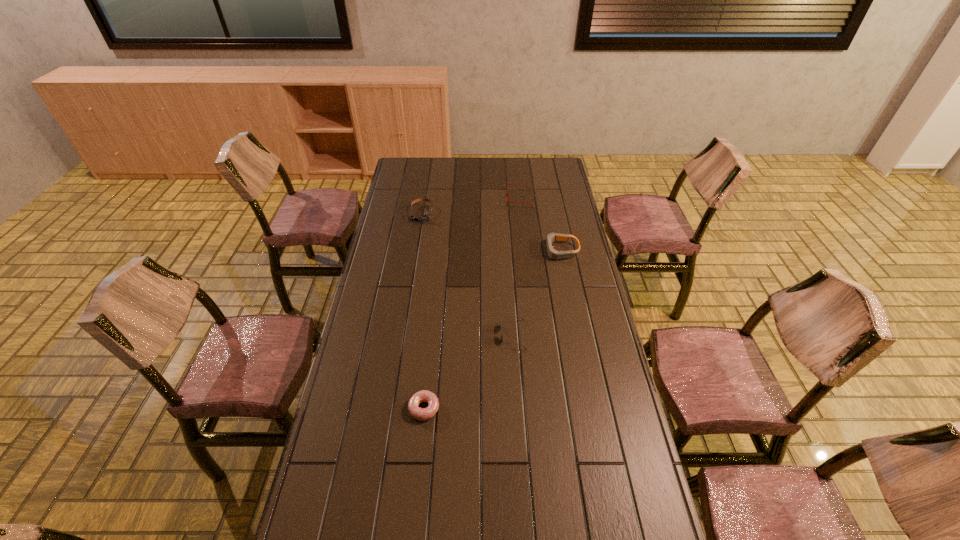
You are a GUI agent. You are given a task and a screenshot of the screen. Output one action in this format:
    pyautogui.click(x=<x>, y=<y>)
    Task: Click on the empty space between the spectacles and the left goggles
    
    Given the screenshot: What is the action you would take?
    pyautogui.click(x=470, y=206)

Where is `vacant space that is in between the leftmost object and the right goggles`? vacant space that is in between the leftmost object and the right goggles is located at coordinates (492, 232).

Locate which object is the fifth closest to the rightmost object. Please provide its 2D coordinates. Your answer should be formatted as a tuple, i.e. [(x, y)], where the tuple contains the x and y coordinates of a point satisfying the conditions above.

[(558, 538)]

At what (x,y) coordinates should I click in order to perform the action: click on object that is the closest to the nearest object. Please return your answer as a coordinate pair (x, y). The width and height of the screenshot is (960, 540). Looking at the image, I should click on (421, 414).

Find the location of a particular element. This screenshot has width=960, height=540. vacant area that satisfies the following two spatial constraints: 1. on the front-facing side of the farther goggles; 2. on the left side of the fifth farthest object is located at coordinates (391, 408).

What are the coordinates of `free region that satisfies the following two spatial constraints: 1. on the front-facing side of the left goggles; 2. on the left side of the second object from left to right` in the screenshot? It's located at (391, 408).